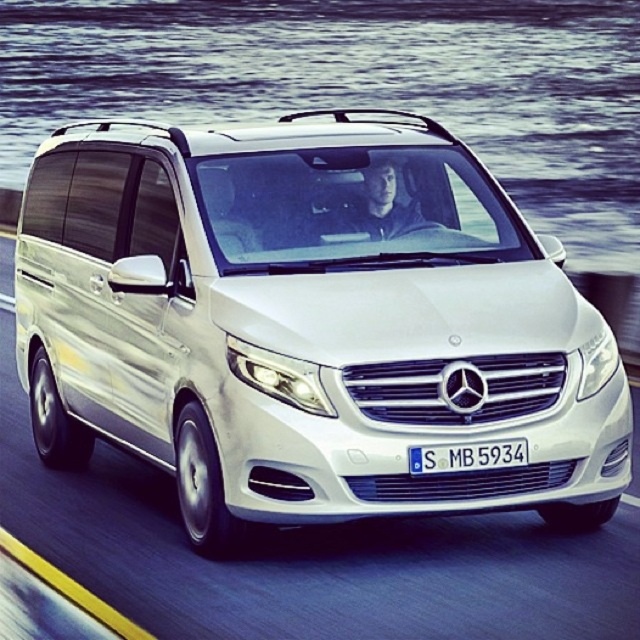
Does clear water at center lie behind white plastic license plate at center?

Yes, clear water at center is further from the viewer.

Is clear water at center positioned in front of white plastic license plate at center?

No, it is not.

The height and width of the screenshot is (640, 640). I want to click on clear water at center, so click(x=362, y=84).

You are a GUI agent. You are given a task and a screenshot of the screen. Output one action in this format:
    pyautogui.click(x=<x>, y=<y>)
    Task: Click on the clear water at center
    
    Given the screenshot: What is the action you would take?
    pyautogui.click(x=362, y=84)

Which is in front, point (243, 147) or point (138, 56)?

Point (243, 147) is more forward.

Which is behind, point (412, 500) or point (612, 264)?

Point (612, 264)

Locate an element on the screen. white metallic van at center is located at coordinates (307, 326).

Can you confirm if clear water at center is positioned below white matte van at center?

No.

Does clear water at center have a lesser width compared to white matte van at center?

In fact, clear water at center might be wider than white matte van at center.

The image size is (640, 640). Identify the location of clear water at center. (362, 84).